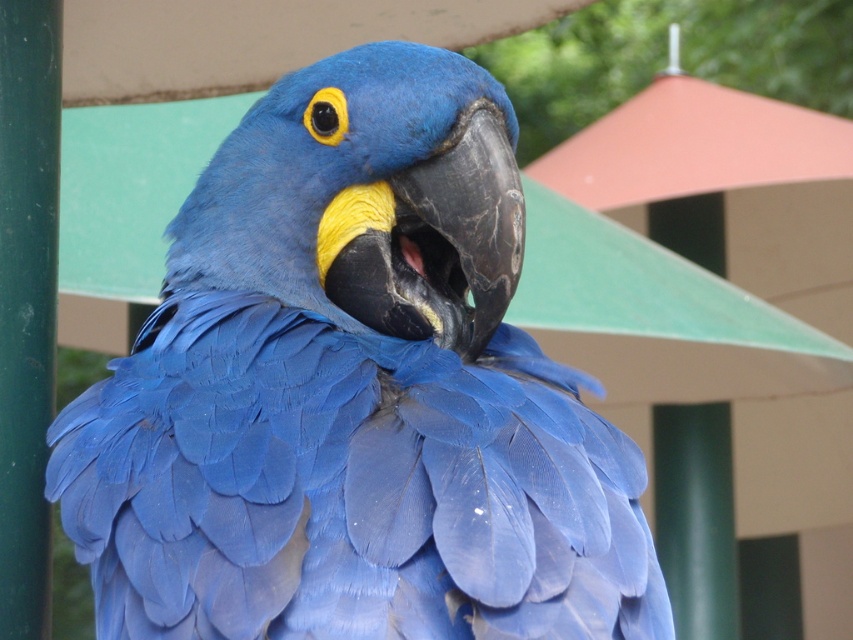
Which is behind, point (306, 429) or point (12, 602)?

The point (12, 602) is more distant.

You are a GUI agent. You are given a task and a screenshot of the screen. Output one action in this format:
    pyautogui.click(x=<x>, y=<y>)
    Task: Click on the matte blue parrot at center
    The image size is (853, 640).
    Given the screenshot: What is the action you would take?
    pyautogui.click(x=354, y=394)